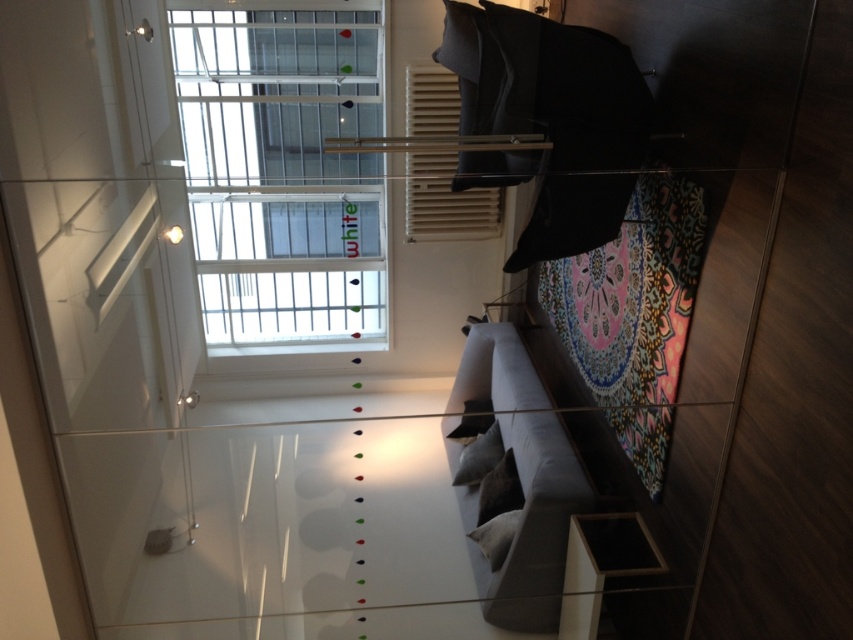
Which is above, transparent glass window at upper center or velvet gray pillow at center?

transparent glass window at upper center is above.

Find the location of `transparent glass window at upper center`. transparent glass window at upper center is located at coordinates (283, 170).

Locate an element on the screen. transparent glass window at upper center is located at coordinates (283, 170).

This screenshot has width=853, height=640. I want to click on transparent glass window at upper center, so click(x=283, y=170).

How distant is velvet gray pillow at center from dark gray fabric pillow at center?

A distance of 19.54 inches exists between velvet gray pillow at center and dark gray fabric pillow at center.

Can you confirm if velvet gray pillow at center is shorter than dark gray fabric pillow at center?

In fact, velvet gray pillow at center may be taller than dark gray fabric pillow at center.

At what (x,y) coordinates should I click in order to perform the action: click on velvet gray pillow at center. Please return your answer as a coordinate pair (x, y). Image resolution: width=853 pixels, height=640 pixels. Looking at the image, I should click on (498, 490).

You are a GUI agent. You are given a task and a screenshot of the screen. Output one action in this format:
    pyautogui.click(x=<x>, y=<y>)
    Task: Click on the velvet gray pillow at center
    Image resolution: width=853 pixels, height=640 pixels.
    Given the screenshot: What is the action you would take?
    pyautogui.click(x=498, y=490)

Is suede-like gray pillow at center bigger than dark gray fabric pillow at center?

Incorrect, suede-like gray pillow at center is not larger than dark gray fabric pillow at center.

Does suede-like gray pillow at center have a lesser width compared to dark gray fabric pillow at center?

Correct, suede-like gray pillow at center's width is less than dark gray fabric pillow at center's.

Is point (503, 451) behind point (450, 438)?

No, (503, 451) is closer to viewer.

I want to click on suede-like gray pillow at center, so click(x=479, y=456).